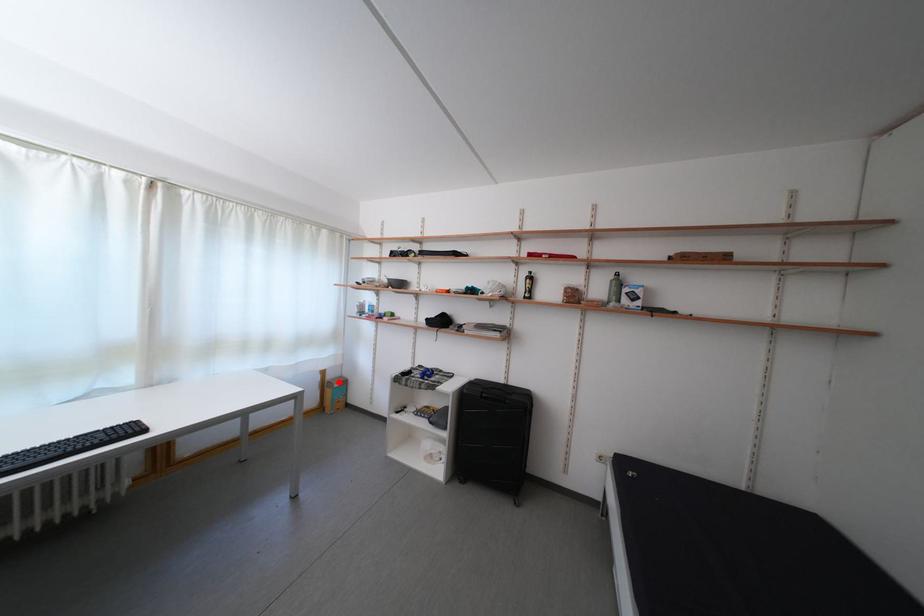
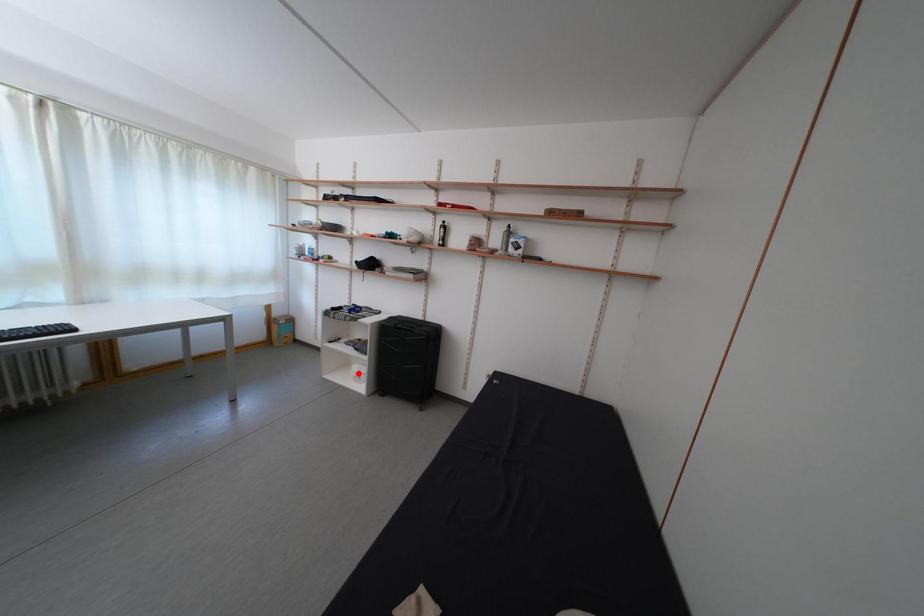
I am providing you with two images of the same scene from different viewpoints. A red point is marked on the first image and another point is marked on the second image. Is the marked point in image1 the same physical position as the marked point in image2?

No